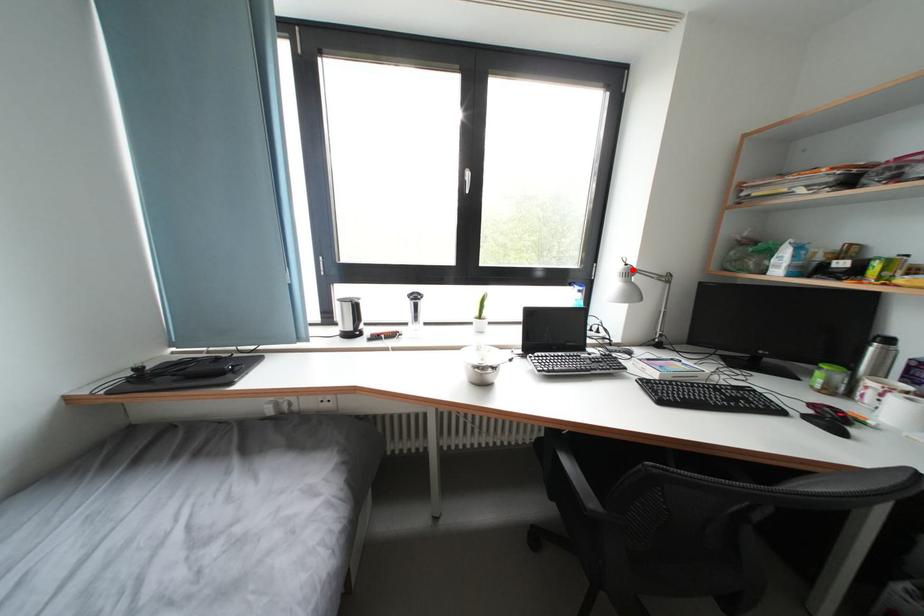
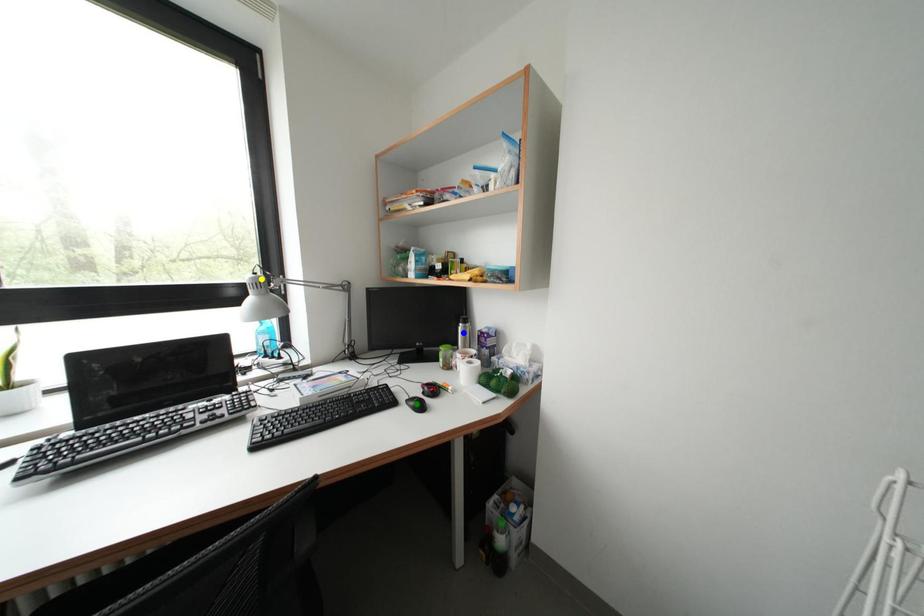
Question: I am providing you with two images of the same scene from different viewpoints. A red point is marked on the first image. You are given multiple points on the second image. Can you choose the point in image 2 that corresponds to the point in image 1?

Choices:
 (A) blue point
 (B) green point
 (C) yellow point

Answer: (C)